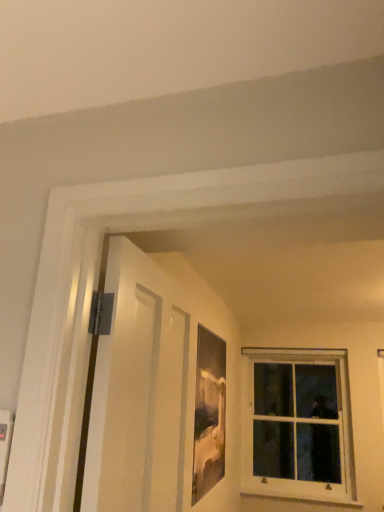
Question: Is matte wooden picture frame at center taller or shorter than white matte door at left?

Choices:
 (A) tall
 (B) short

Answer: (A)

Question: Looking at their shapes, would you say matte wooden picture frame at center is wider or thinner than white matte door at left?

Choices:
 (A) thin
 (B) wide

Answer: (A)

Question: Based on their relative distances, which object is farther from the matte wooden picture frame at center?

Choices:
 (A) white matte door at left
 (B) white wood window at upper right

Answer: (B)

Question: Which is farther from the matte wooden picture frame at center?

Choices:
 (A) white wood window at upper right
 (B) white matte door at left

Answer: (A)